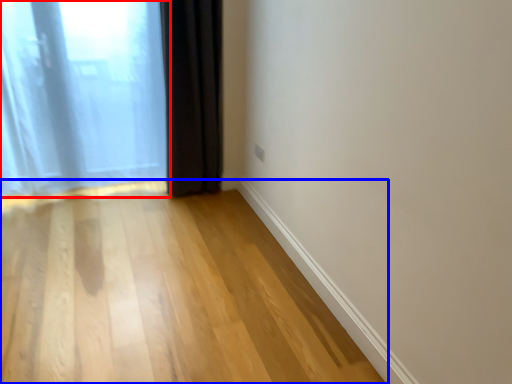
Question: Which object appears farthest to the camera in this image, curtain (highlighted by a red box) or corridor (highlighted by a blue box)?

Choices:
 (A) curtain
 (B) corridor

Answer: (A)